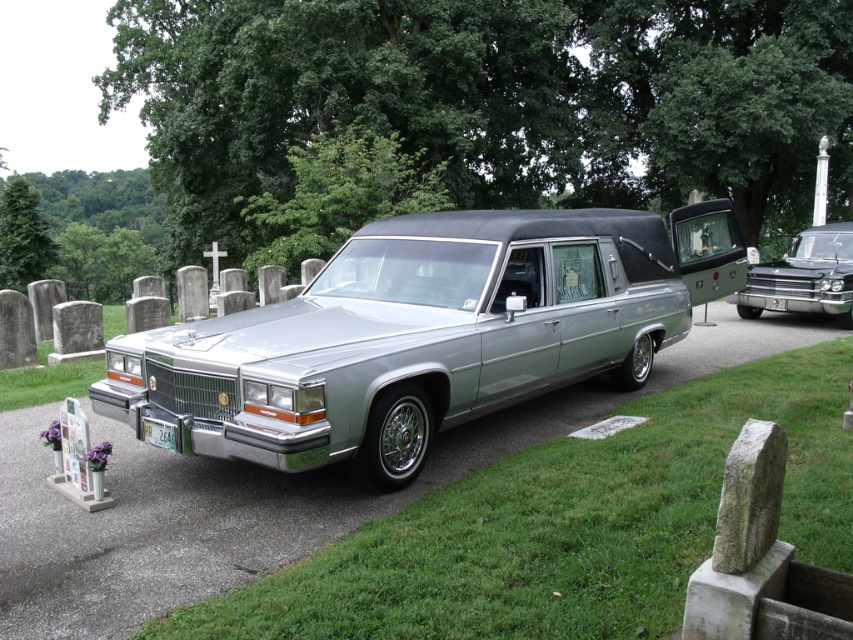
Is silver metallic hearse at center to the left of metallic silver hearse at center from the viewer's perspective?

Yes, silver metallic hearse at center is to the left of metallic silver hearse at center.

Is point (662, 340) positioned behind point (813, 301)?

No.

Locate an element on the screen. silver metallic hearse at center is located at coordinates (425, 333).

Does silver metallic hearse at center have a smaller size compared to green matte license plate at lower center?

Actually, silver metallic hearse at center might be larger than green matte license plate at lower center.

Which is behind, point (570, 344) or point (152, 440)?

Point (570, 344)

The height and width of the screenshot is (640, 853). Describe the element at coordinates (425, 333) in the screenshot. I see `silver metallic hearse at center` at that location.

Identify the location of silver metallic hearse at center. The image size is (853, 640). (425, 333).

Who is more forward, (x=752, y=275) or (x=161, y=444)?

Point (x=161, y=444) is in front.

Does metallic silver hearse at center have a lesser width compared to green matte license plate at lower center?

No, metallic silver hearse at center is not thinner than green matte license plate at lower center.

At what (x,y) coordinates should I click in order to perform the action: click on metallic silver hearse at center. Please return your answer as a coordinate pair (x, y). This screenshot has width=853, height=640. Looking at the image, I should click on (804, 276).